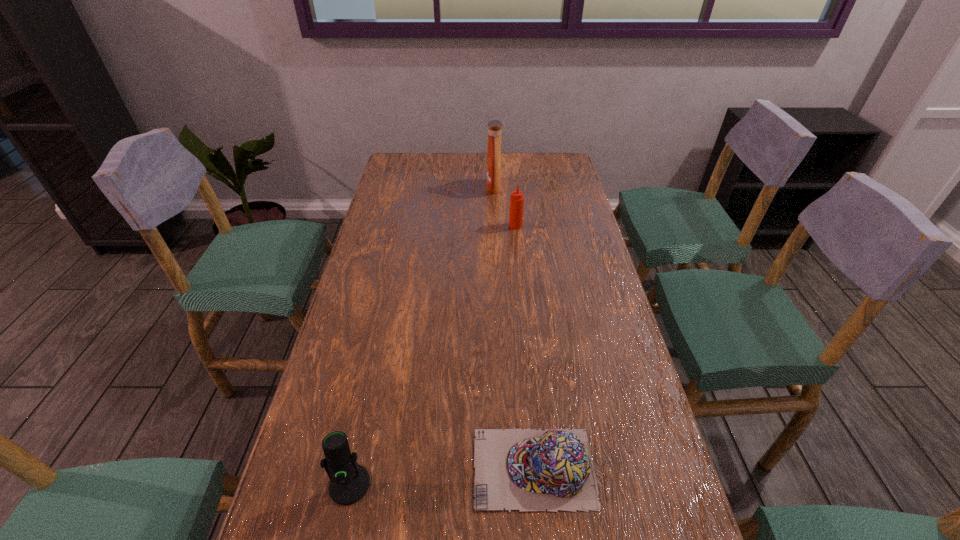
I want to click on free space located 0.360m on the front, side, and top of the cap, so click(x=292, y=468).

Find the location of a particular element. This screenshot has height=540, width=960. free space located 0.090m on the front, side, and top of the cap is located at coordinates [x=428, y=468].

Locate an element on the screen. The width and height of the screenshot is (960, 540). free region located on the front, side, and top of the cap is located at coordinates (368, 468).

Identify the location of object located at the far edge. (494, 126).

Where is `object that is at the left edge`? object that is at the left edge is located at coordinates (349, 481).

Where is `object situated at the right edge`? This screenshot has height=540, width=960. object situated at the right edge is located at coordinates (527, 470).

In the image, there is a desktop. Where is `free space at the far edge`? free space at the far edge is located at coordinates (463, 164).

This screenshot has height=540, width=960. In order to click on free location at the left edge in this screenshot , I will do `click(314, 510)`.

In the image, there is a desktop. Where is `vacant space at the right edge`? The height and width of the screenshot is (540, 960). vacant space at the right edge is located at coordinates (585, 348).

Locate an element on the screen. This screenshot has height=540, width=960. vacant space at the far left corner of the desktop is located at coordinates (427, 156).